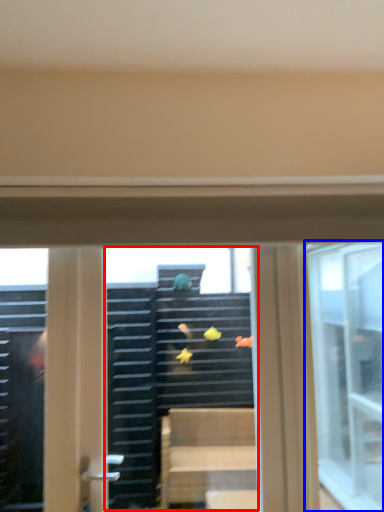
Question: Which point is closer to the camera, shop window (highlighted by a red box) or window (highlighted by a blue box)?

Choices:
 (A) shop window
 (B) window

Answer: (A)